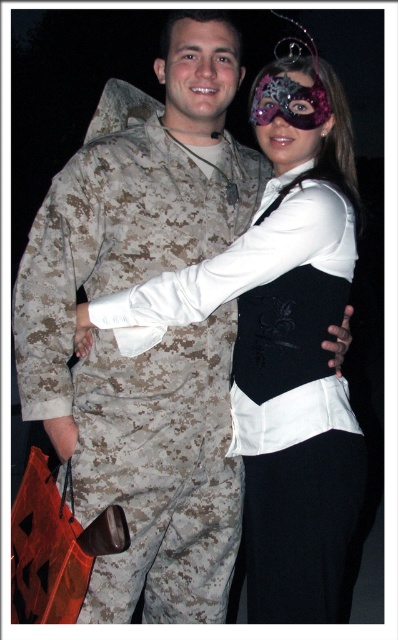
Question: Does matte camouflage uniform at center have a smaller size compared to smooth skin face at center?

Choices:
 (A) no
 (B) yes

Answer: (A)

Question: Does matte camouflage uniform at center appear under smooth skin face at center?

Choices:
 (A) no
 (B) yes

Answer: (B)

Question: Based on their relative distances, which object is farther from the matte camouflage uniform at center?

Choices:
 (A) sparkly purple mask at center
 (B) smooth skin face at center

Answer: (B)

Question: Estimate the real-world distances between objects in this image. Which object is closer to the matte camouflage uniform at center?

Choices:
 (A) sparkly purple mask at center
 (B) smooth skin face at center

Answer: (A)

Question: Which object appears farthest from the camera in this image?

Choices:
 (A) sparkly purple mask at center
 (B) matte camouflage uniform at center
 (C) smooth skin face at center

Answer: (C)

Question: Is matte camouflage uniform at center thinner than smooth skin face at center?

Choices:
 (A) yes
 (B) no

Answer: (B)